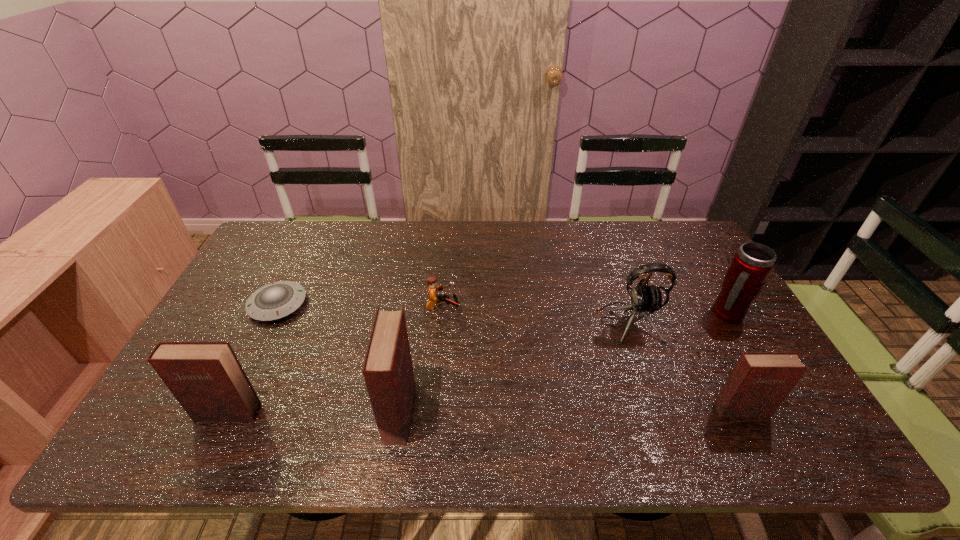
You are a GUI agent. You are given a task and a screenshot of the screen. Output one action in this format:
    pyautogui.click(x=<x>, y=<y>)
    Task: Click on the vacant spot for a new diary to ensure equal spacing
    The width and height of the screenshot is (960, 540).
    Given the screenshot: What is the action you would take?
    pyautogui.click(x=570, y=411)